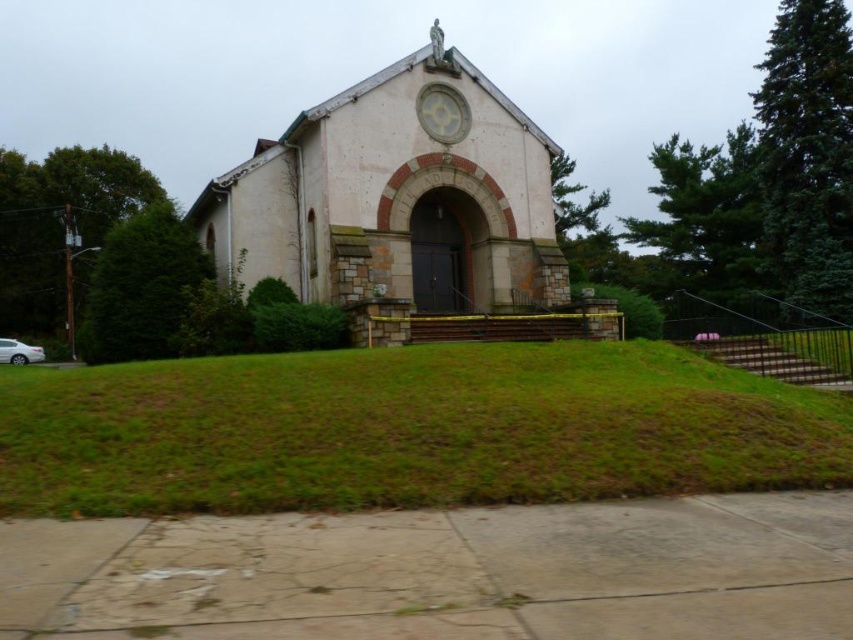
Is white stone church at center above white glossy sedan at lower left?

Correct, white stone church at center is located above white glossy sedan at lower left.

Consider the image. Which of these two, white stone church at center or white glossy sedan at lower left, stands shorter?

Standing shorter between the two is white glossy sedan at lower left.

Find the location of a particular element. This screenshot has width=853, height=640. white stone church at center is located at coordinates (405, 211).

Is green grass at center positioned behind white glossy sedan at lower left?

No, green grass at center is in front of white glossy sedan at lower left.

Find the location of a particular element. The width and height of the screenshot is (853, 640). green grass at center is located at coordinates (407, 429).

Where is `green grass at center`? This screenshot has height=640, width=853. green grass at center is located at coordinates (407, 429).

From the picture: Does green grass at center appear under white stone church at center?

Yes.

The image size is (853, 640). What do you see at coordinates (407, 429) in the screenshot?
I see `green grass at center` at bounding box center [407, 429].

The width and height of the screenshot is (853, 640). Identify the location of green grass at center. (407, 429).